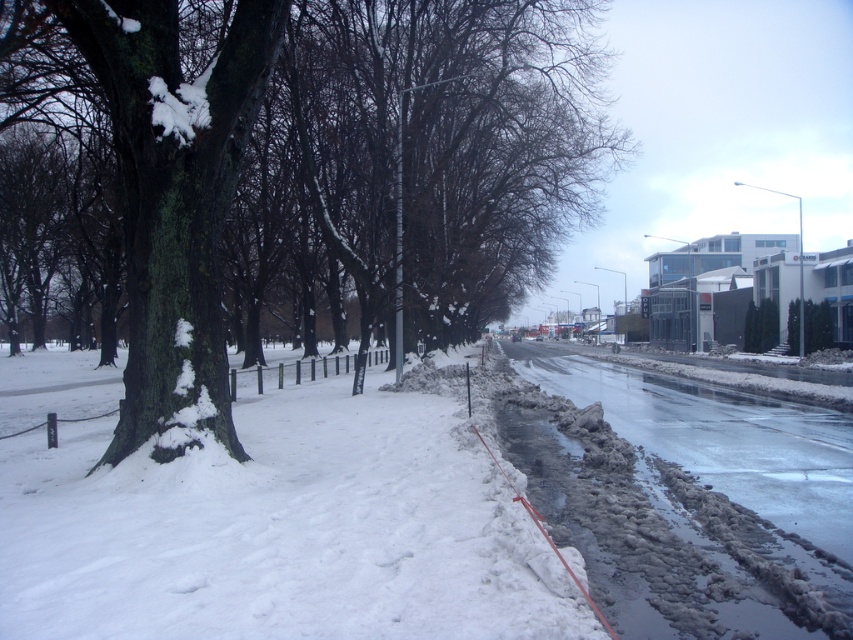
Question: Estimate the real-world distances between objects in this image. Which object is closer to the slick asphalt road at lower right?

Choices:
 (A) green mossy bark tree at left
 (B) white fluffy snow at lower left

Answer: (B)

Question: Can you confirm if white fluffy snow at lower left is positioned to the right of slick asphalt road at lower right?

Choices:
 (A) yes
 (B) no

Answer: (B)

Question: Does white fluffy snow at lower left appear over slick asphalt road at lower right?

Choices:
 (A) yes
 (B) no

Answer: (A)

Question: Is green mossy bark tree at left to the left of white fluffy snow at lower left from the viewer's perspective?

Choices:
 (A) yes
 (B) no

Answer: (A)

Question: Which object is the farthest from the green mossy bark tree at left?

Choices:
 (A) slick asphalt road at lower right
 (B) white fluffy snow at lower left

Answer: (A)

Question: Which object is closer to the camera taking this photo?

Choices:
 (A) white fluffy snow at lower left
 (B) green mossy bark tree at left
 (C) slick asphalt road at lower right

Answer: (A)